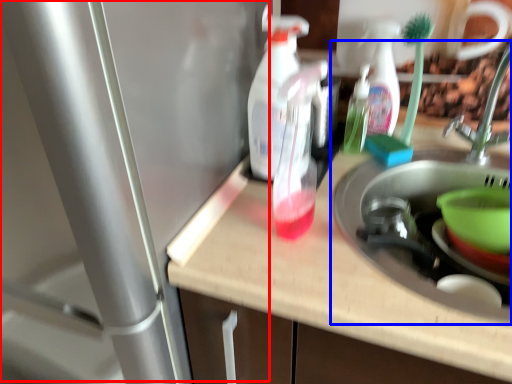
Question: Which point is closer to the camera, water heater (highlighted by a red box) or sink (highlighted by a blue box)?

Choices:
 (A) water heater
 (B) sink

Answer: (A)